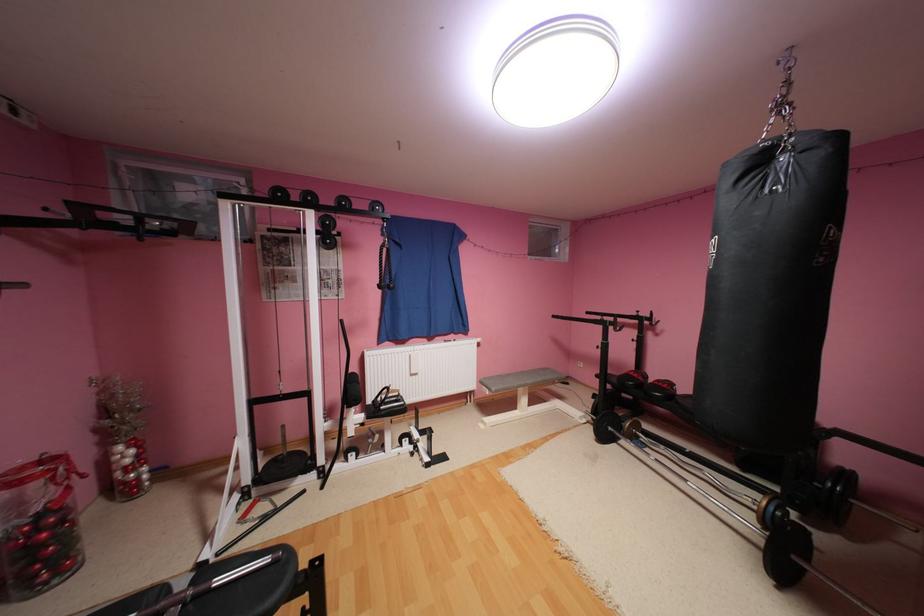
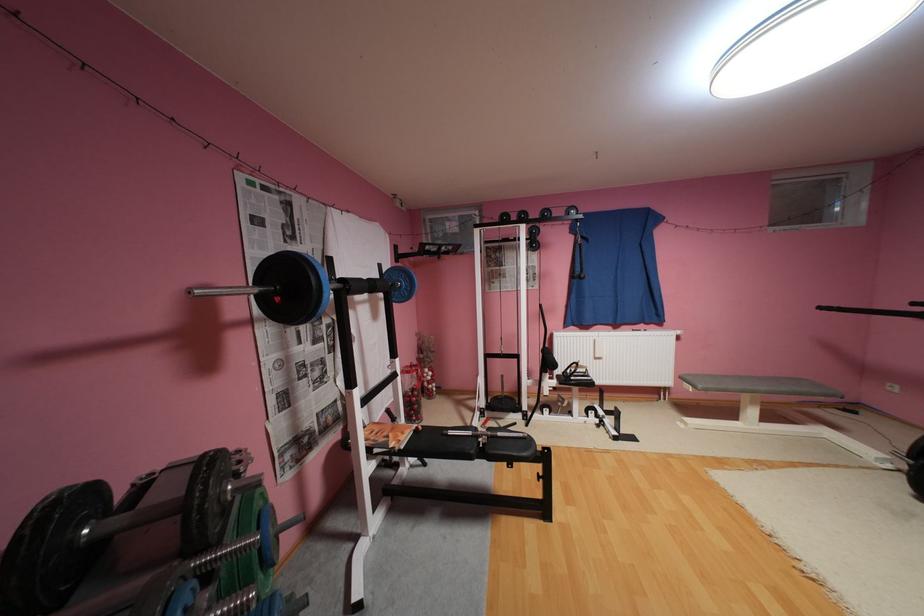
Where in the second image is the point corresponding to point 525,408 from the first image?

(746, 419)